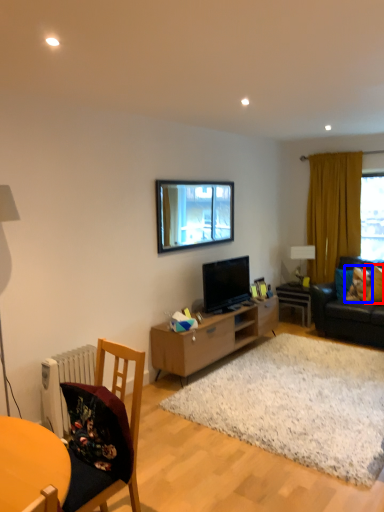
Question: Which of the following is the closest to the observer, pillow (highlighted by a red box) or pillow (highlighted by a blue box)?

Choices:
 (A) pillow
 (B) pillow

Answer: (A)